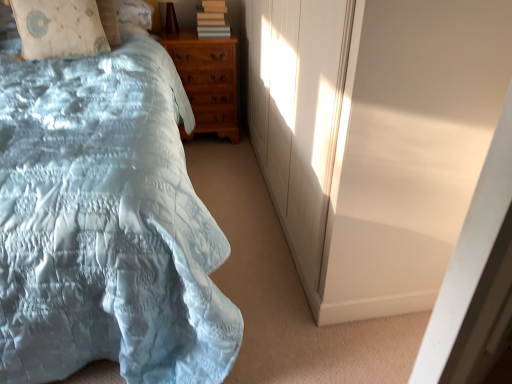
Find the location of `vacant region in front of matte brown table lamp at upper center`. vacant region in front of matte brown table lamp at upper center is located at coordinates click(170, 39).